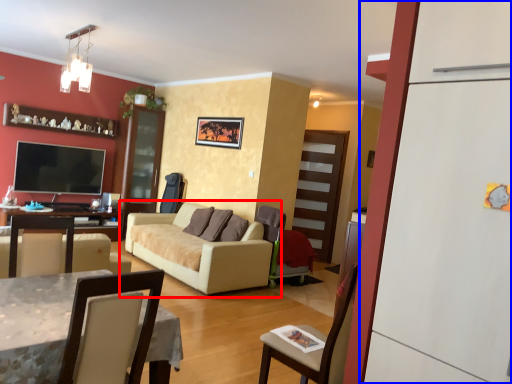
Question: Among these objects, which one is nearest to the camera, studio couch (highlighted by a red box) or fridge (highlighted by a blue box)?

Choices:
 (A) studio couch
 (B) fridge

Answer: (B)